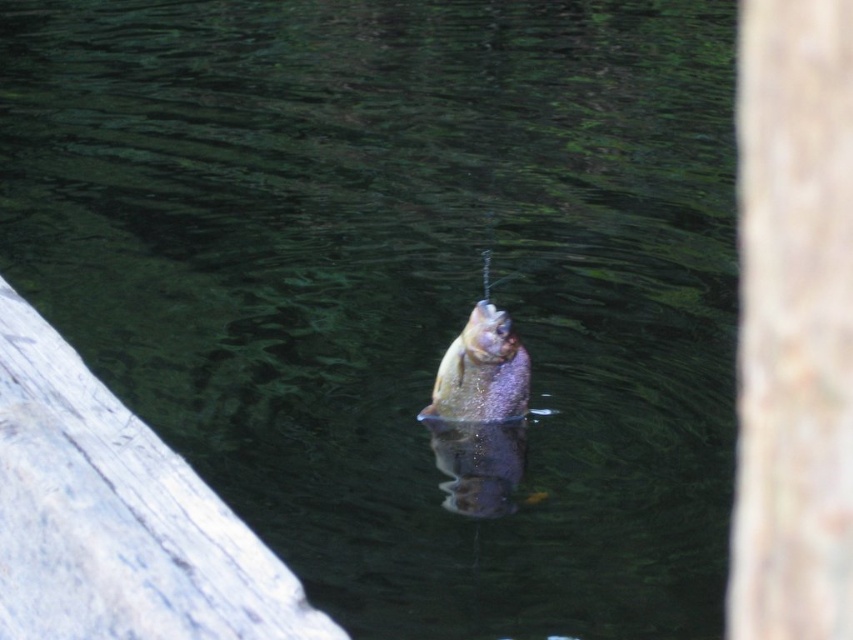
Describe the element at coordinates (793, 323) in the screenshot. The image size is (853, 640). I see `smooth brown tree trunk at right` at that location.

Is point (840, 484) closer to camera compared to point (447, 429)?

Yes, it is.

Find the location of a particular element. This screenshot has height=640, width=853. smooth brown tree trunk at right is located at coordinates (793, 323).